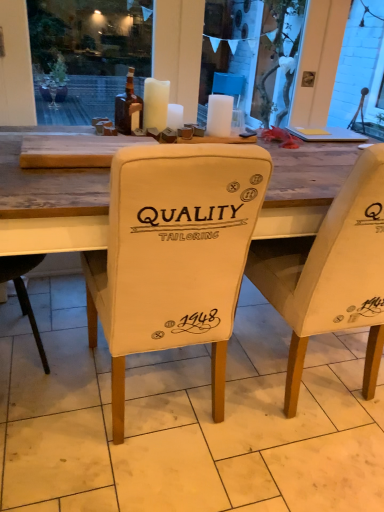
Question: From a real-world perspective, does white matte candle at upper center, which is the 1th candle in right-to-left order, sit lower than beige fabric chair at center, positioned as the second chair in left-to-right order?

Choices:
 (A) yes
 (B) no

Answer: (B)

Question: Can you confirm if white matte candle at upper center, arranged as the 3th candle when viewed from the left, is positioned to the right of beige fabric chair at center, positioned as the second chair in left-to-right order?

Choices:
 (A) yes
 (B) no

Answer: (B)

Question: Can we say white matte candle at upper center, arranged as the 3th candle when viewed from the left, lies outside beige fabric chair at center, positioned as the second chair in left-to-right order?

Choices:
 (A) no
 (B) yes

Answer: (B)

Question: Is white matte candle at upper center, which is the 1th candle in right-to-left order, bigger than beige fabric chair at center, the 1th chair when ordered from right to left?

Choices:
 (A) no
 (B) yes

Answer: (A)

Question: From a real-world perspective, is white matte candle at upper center, which is the 1th candle in right-to-left order, on top of beige fabric chair at center, positioned as the second chair in left-to-right order?

Choices:
 (A) yes
 (B) no

Answer: (A)

Question: From the image's perspective, is white matte candle at upper center, which is the 1th candle in right-to-left order, above beige fabric chair at center, the 1th chair when ordered from right to left?

Choices:
 (A) no
 (B) yes

Answer: (B)

Question: Can you confirm if brown glass bottle at upper center is positioned to the left of beige fabric chair at center, positioned as the second chair in left-to-right order?

Choices:
 (A) yes
 (B) no

Answer: (A)

Question: Is brown glass bottle at upper center touching beige fabric chair at center, positioned as the second chair in left-to-right order?

Choices:
 (A) yes
 (B) no

Answer: (B)

Question: Is the position of brown glass bottle at upper center more distant than that of beige fabric chair at center, the 1th chair when ordered from right to left?

Choices:
 (A) yes
 (B) no

Answer: (A)

Question: Can you confirm if brown glass bottle at upper center is thinner than beige fabric chair at center, positioned as the second chair in left-to-right order?

Choices:
 (A) yes
 (B) no

Answer: (A)

Question: Is brown glass bottle at upper center not inside beige fabric chair at center, the 1th chair when ordered from right to left?

Choices:
 (A) no
 (B) yes

Answer: (B)

Question: Is beige fabric chair at center, positioned as the second chair in left-to-right order, completely or partially inside brown glass bottle at upper center?

Choices:
 (A) yes
 (B) no

Answer: (B)

Question: Considering the relative sizes of beige fabric chair at center, which is counted as the second chair, starting from the right, and white fabric chair cover at center in the image provided, is beige fabric chair at center, which is counted as the second chair, starting from the right, smaller than white fabric chair cover at center?

Choices:
 (A) no
 (B) yes

Answer: (A)